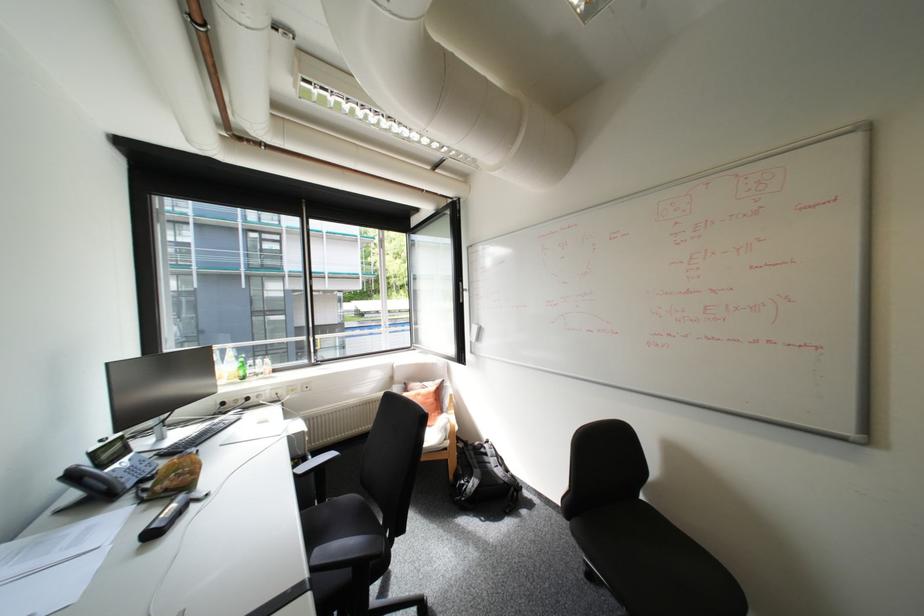
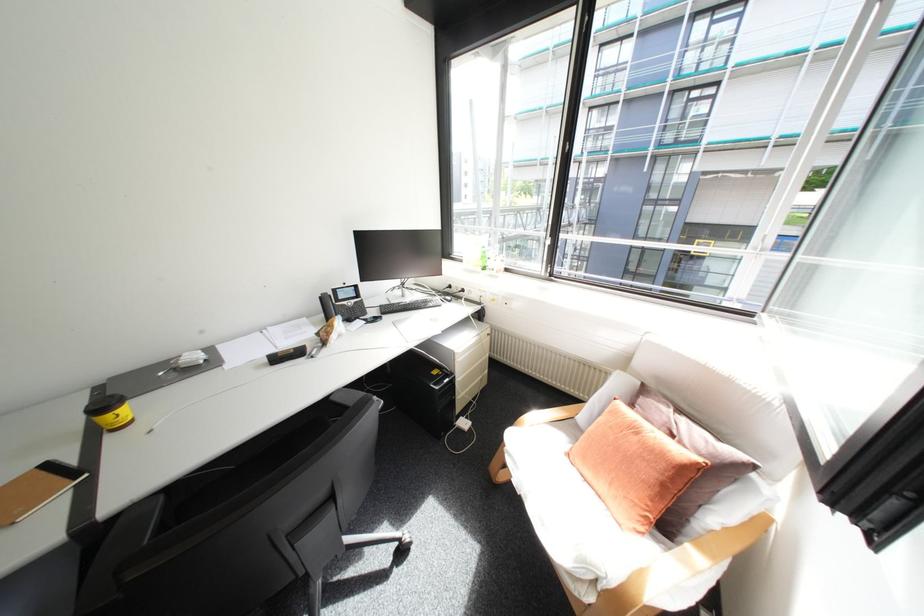
The point at (245, 377) is marked in the first image. Where is the corresponding point in the second image?

(487, 265)